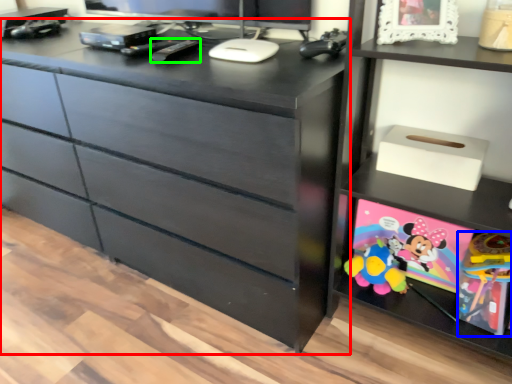
Question: Which object is positioned closest to chest of drawers (highlighted by a red box)? Select from toy (highlighted by a blue box) and remote (highlighted by a green box).

Choices:
 (A) toy
 (B) remote

Answer: (B)